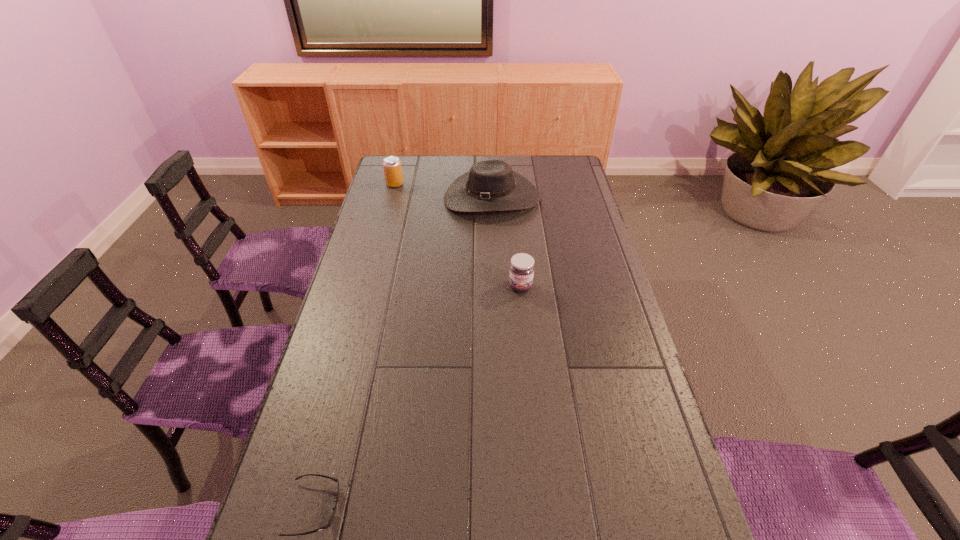
Identify the location of pop (soda) located in the far edge section of the desktop. (392, 167).

This screenshot has width=960, height=540. I want to click on pop (soda) positioned at the left edge, so click(x=392, y=167).

Find the location of `sunglasses positioned at the left edge`. sunglasses positioned at the left edge is located at coordinates (336, 480).

Find the location of a particular element. object that is at the far left corner is located at coordinates (x=392, y=167).

I want to click on free space at the far edge, so click(483, 159).

The image size is (960, 540). Identify the location of blank space at the left edge. (354, 323).

In order to click on free region at the right edge in this screenshot , I will do `click(564, 238)`.

The image size is (960, 540). I want to click on vacant area at the far left corner of the desktop, so click(417, 157).

This screenshot has height=540, width=960. In order to click on empty location between the sunglasses and the jam in this screenshot , I will do `click(418, 397)`.

The width and height of the screenshot is (960, 540). Find the location of `empty space between the sunglasses and the cowboy hat`. empty space between the sunglasses and the cowboy hat is located at coordinates (403, 353).